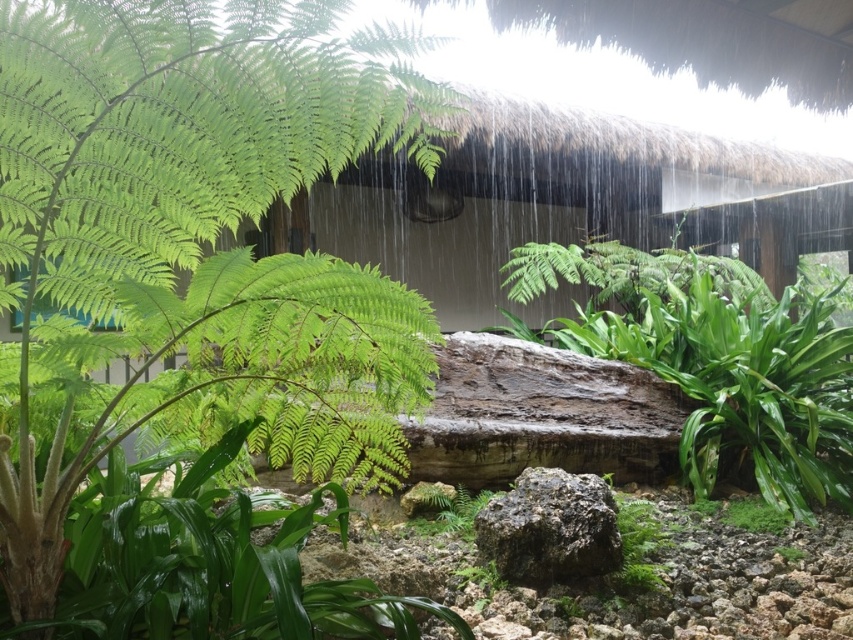
Does green leafy plant at center have a larger size compared to green mossy rock at center?

Yes.

Is green leafy plant at center above green mossy rock at center?

Indeed, green leafy plant at center is positioned over green mossy rock at center.

The image size is (853, 640). Find the location of `green leafy plant at center`. green leafy plant at center is located at coordinates (714, 358).

Measure the distance between green leafy fern at left and green mossy rock at center.

They are 28.54 inches apart.

Does green leafy fern at left have a greater height compared to green mossy rock at center?

Correct, green leafy fern at left is much taller as green mossy rock at center.

Is point (328, 49) positioned in front of point (543, 529)?

Yes, it is in front of point (543, 529).

Find the location of a particular element. This screenshot has height=640, width=853. green leafy fern at left is located at coordinates (196, 237).

Is point (44, 24) closer to viewer compared to point (640, 332)?

Yes, it is in front of point (640, 332).

Locate an element on the screen. The height and width of the screenshot is (640, 853). green leafy fern at left is located at coordinates (196, 237).

Is point (57, 211) farther from camera compared to point (833, 417)?

No, (57, 211) is closer to viewer.

This screenshot has width=853, height=640. Identify the location of green leafy fern at left. (196, 237).